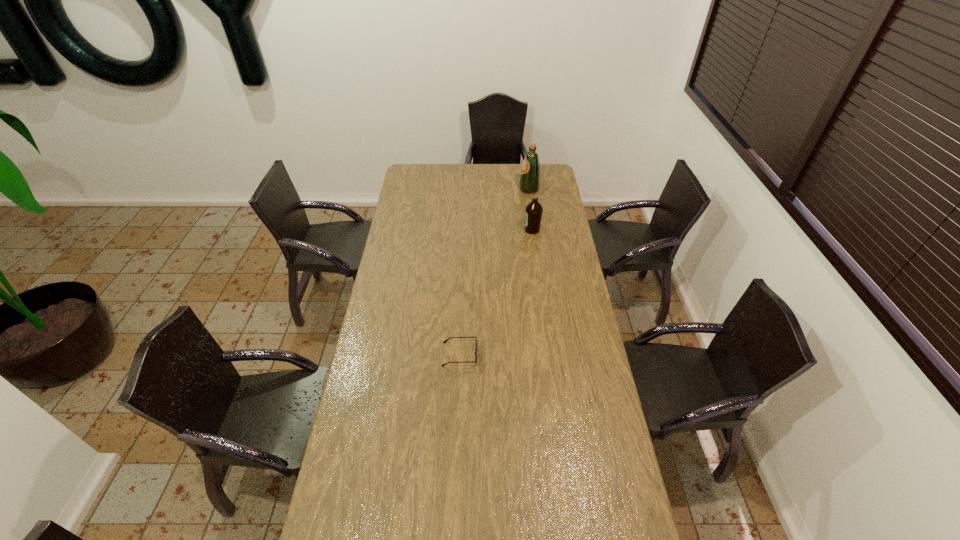
Locate an element on the screen. Image resolution: width=960 pixels, height=540 pixels. the farthest object is located at coordinates tap(530, 175).

Locate an element on the screen. the tallest object is located at coordinates (530, 175).

You are a GUI agent. You are given a task and a screenshot of the screen. Output one action in this format:
    pyautogui.click(x=<x>, y=<y>)
    Task: Click on the shorter olive oil
    This screenshot has height=540, width=960.
    Given the screenshot: What is the action you would take?
    pyautogui.click(x=533, y=212)

Find the location of a particular element. the second nearest object is located at coordinates (533, 212).

This screenshot has width=960, height=540. In order to click on spectacles in this screenshot , I will do `click(445, 341)`.

Where is `the shortest object`? Image resolution: width=960 pixels, height=540 pixels. the shortest object is located at coordinates (445, 341).

Image resolution: width=960 pixels, height=540 pixels. I want to click on free point located on the front-facing side of the farther olive oil, so click(496, 189).

Identify the location of vacant space located 0.080m on the front-facing side of the farther olive oil. (505, 189).

In order to click on vacant space located on the front-facing side of the farther olive oil in this screenshot , I will do `click(452, 189)`.

This screenshot has height=540, width=960. I want to click on free space located on the label of the second nearest object, so click(x=457, y=230).